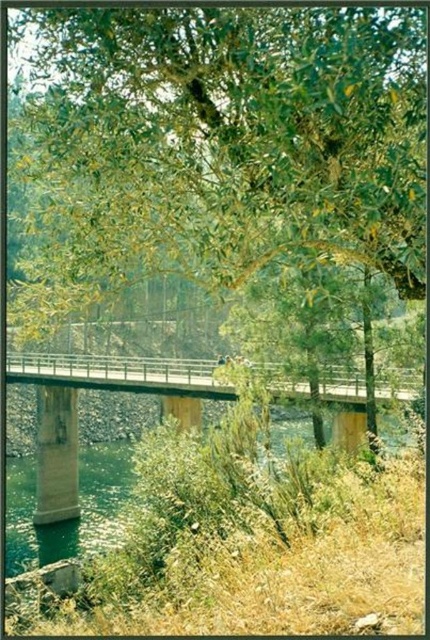
You are standing on the metallic gray bridge at center and want to take a photo of the green leafy tree at center. Which object will appear closer to you in the photo?

The green leafy tree at center will appear closer to you in the photo because it is in front of the metallic gray bridge at center.